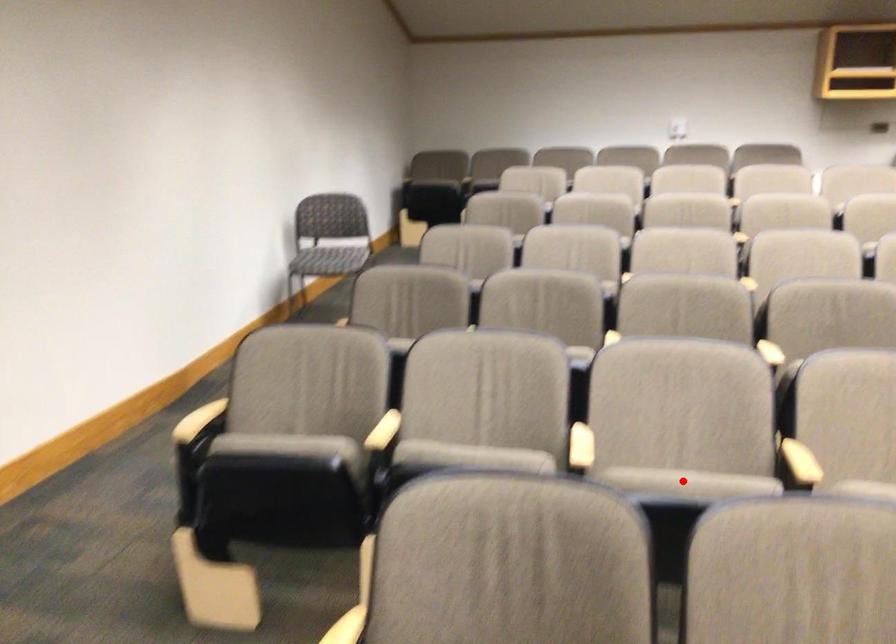
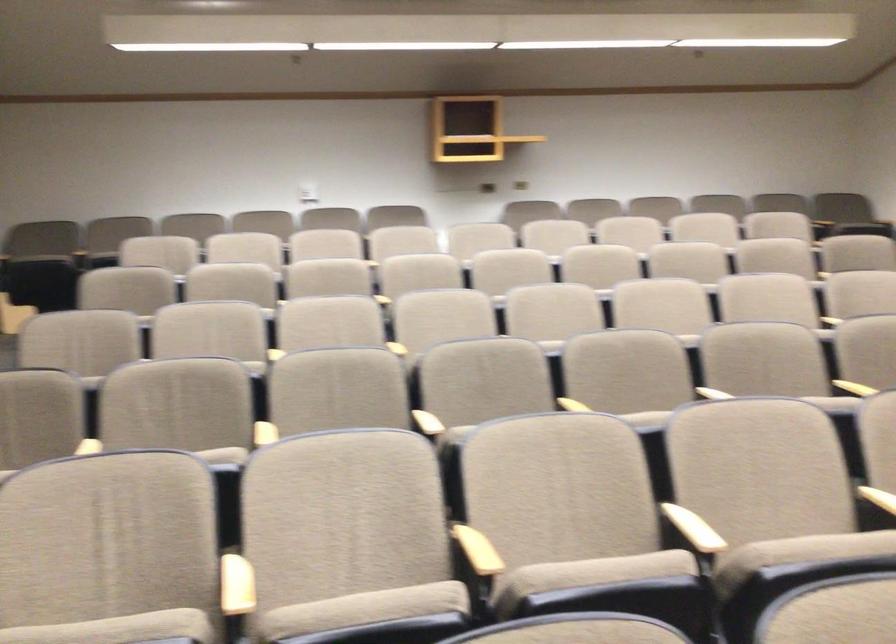
Question: I am providing you with two images of the same scene from different viewpoints. A red point is marked on the first image. Can you still see the location of the red point in image 2?

Choices:
 (A) Yes
 (B) No

Answer: (A)